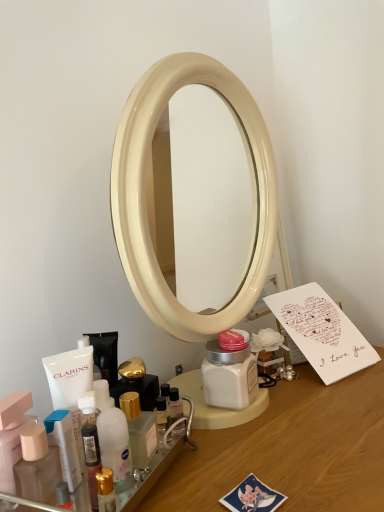
The width and height of the screenshot is (384, 512). Find the location of `unoccupied region to the right of translucent plastic bottle at lower left, which appears as the first toiletry when viewed from the right`. unoccupied region to the right of translucent plastic bottle at lower left, which appears as the first toiletry when viewed from the right is located at coordinates click(x=273, y=455).